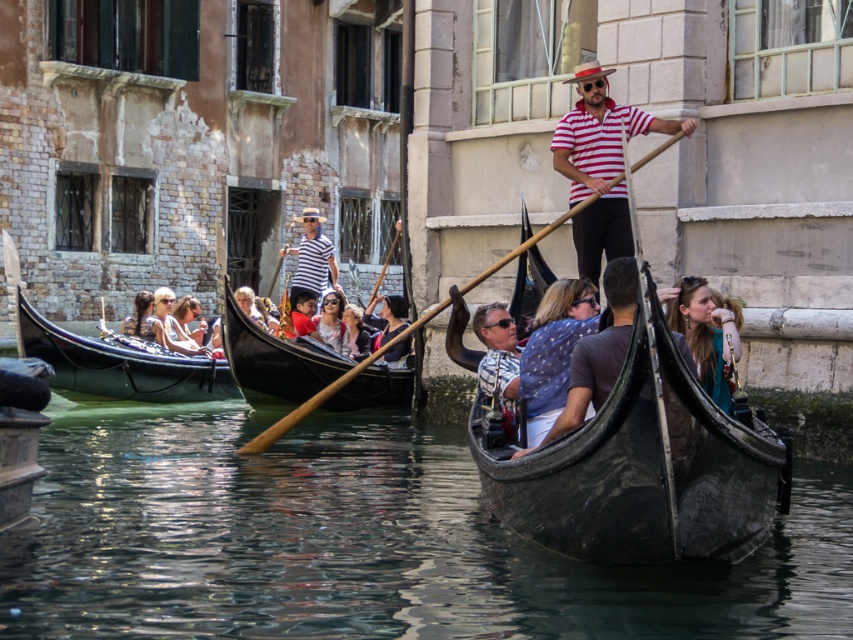
You are a tourist standing on the bridge overlooking the canal. You see a matte blue shirt at center and a matte pink sunglasses at center. If you want to take a photo that includes both items, which one should you zoom in on more to ensure both are in focus?

The matte blue shirt at center is 26.68 meters away from the matte pink sunglasses at center. To ensure both are in focus, you should zoom in on the matte blue shirt at center since it is farther away and requires more focus adjustment.

You are standing on the canal bank and want to throw a small pebble to the point marked at coordinates (689,365). If your throwing range is 20 meters, will you be able to reach that point?

The point marked at coordinates (689,365) is 22.27 meters away from the viewer. Since your throwing range is only 20 meters, you cannot reach that point.

You are a tourist standing on the bridge above the canal. You notice two people below you on the gondola. One is wearing a matte blue shirt at center and the other has matte black hair at center. Which of these two people is closer to you?

The matte blue shirt at center is smaller than the matte black hair at center, so the person with the matte black hair at center is closer to you because objects closer to the observer appear larger.